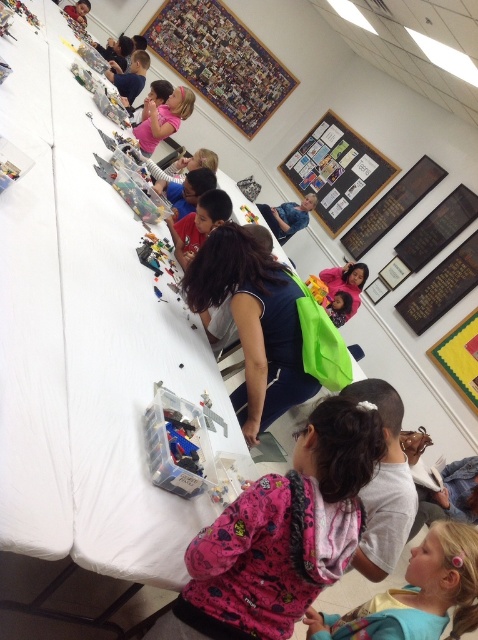
Question: Which of the following is the farthest from the observer?

Choices:
 (A) (315, 412)
 (B) (307, 221)
 (C) (440, 596)
 (D) (348, 252)

Answer: (B)

Question: Is wooden puzzle at upper center bigger than black matte board at upper center?

Choices:
 (A) yes
 (B) no

Answer: (A)

Question: Is pink fabric at lower right further to camera compared to pink fabric backpack at center?

Choices:
 (A) no
 (B) yes

Answer: (A)

Question: Which of these objects is positioned farthest from the wooden puzzle at upper center?

Choices:
 (A) pink fabric shirt at upper center
 (B) pink fleece jacket at lower center

Answer: (B)

Question: Which object is closer to the camera taking this photo?

Choices:
 (A) dark blue fabric at center
 (B) wooden noticeboard at upper center

Answer: (A)

Question: Does dark blue fabric at center have a lesser width compared to pink fabric shirt at upper center?

Choices:
 (A) no
 (B) yes

Answer: (A)